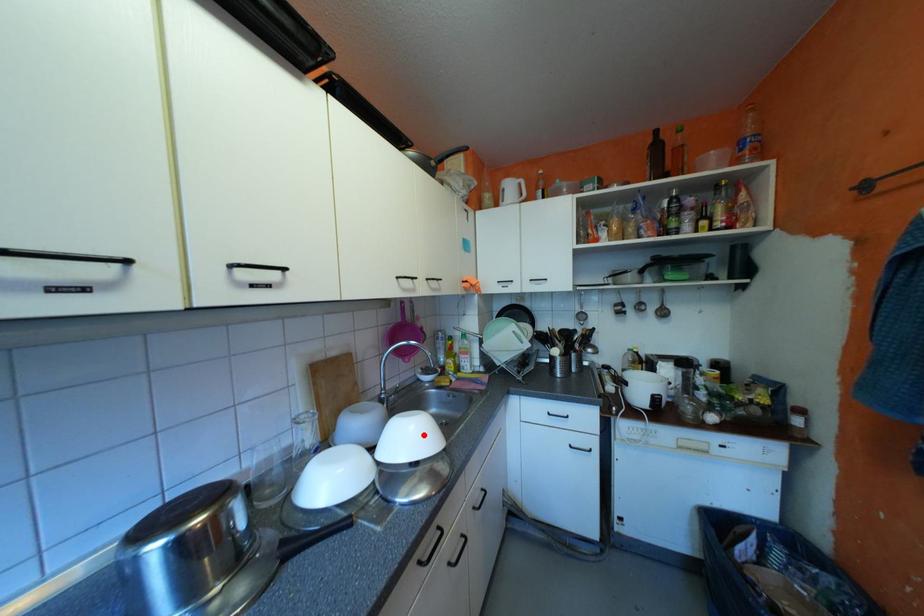
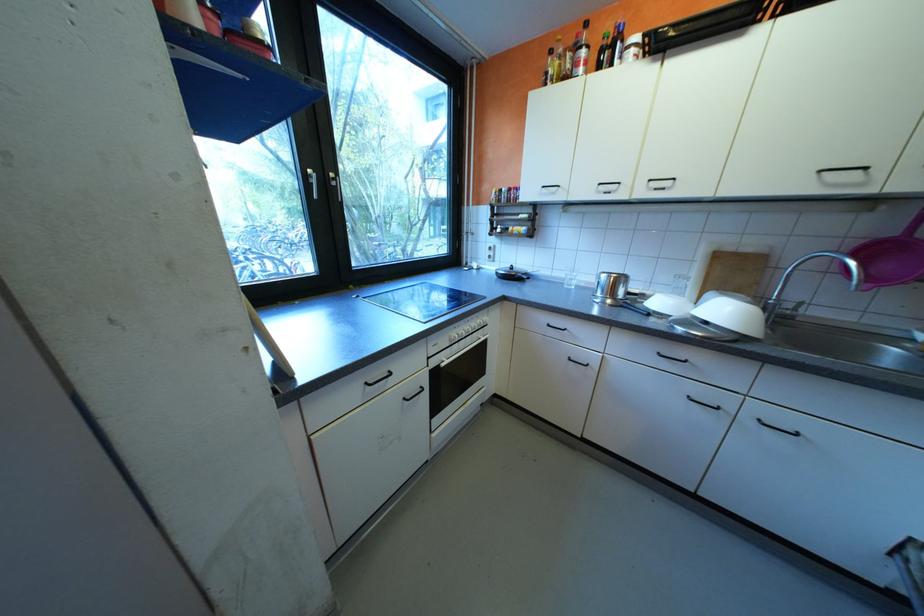
The point at the highlighted location is marked in the first image. Where is the corresponding point in the second image?

(736, 312)